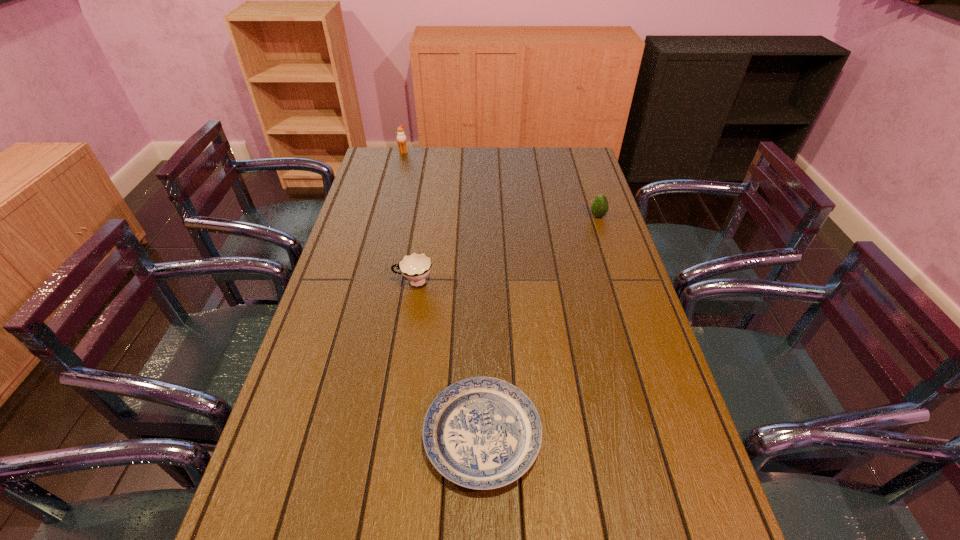
I want to click on the tallest object, so click(x=401, y=137).

This screenshot has height=540, width=960. Find the location of `the leftmost object`. the leftmost object is located at coordinates (401, 137).

Find the location of a particular element. The width and height of the screenshot is (960, 540). the third nearest object is located at coordinates (599, 208).

Identify the location of the rightmost object. (599, 208).

Locate an element on the screen. cup is located at coordinates (415, 267).

Where is `the second nearest object`? The height and width of the screenshot is (540, 960). the second nearest object is located at coordinates (415, 267).

Where is `the second object from right to left`? the second object from right to left is located at coordinates (482, 433).

The image size is (960, 540). I want to click on the nearest object, so click(482, 433).

Identify the location of vacant position located at the front with a straw on the farthest object. This screenshot has height=540, width=960. (392, 200).

Identify the location of vacant area situated on the back of the avocado. The image size is (960, 540). (592, 198).